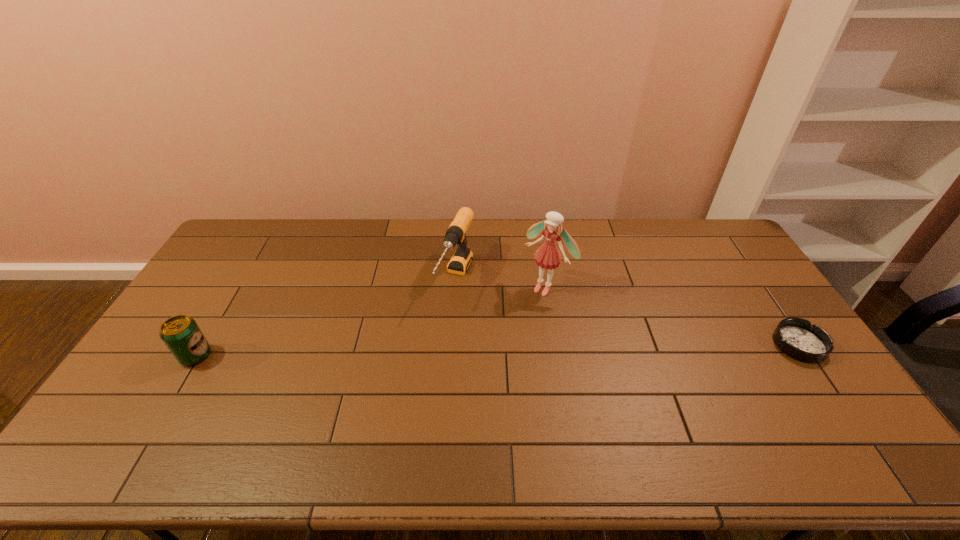
The width and height of the screenshot is (960, 540). In order to click on the leftmost object in this screenshot , I will do `click(181, 334)`.

Where is `the third tallest object`? the third tallest object is located at coordinates pyautogui.click(x=181, y=334).

Where is `the rightmost object`? The image size is (960, 540). the rightmost object is located at coordinates (797, 338).

You are a GUI agent. You are given a task and a screenshot of the screen. Output one action in this format:
    pyautogui.click(x=<x>, y=<y>)
    Task: Click on the ashtray
    The width and height of the screenshot is (960, 540).
    Given the screenshot: What is the action you would take?
    pyautogui.click(x=797, y=338)

The width and height of the screenshot is (960, 540). What are the coordinates of `doll` in the screenshot? It's located at (547, 256).

The image size is (960, 540). Identify the location of the second object from right to left. (547, 256).

Where is `the second tallest object`? the second tallest object is located at coordinates (460, 261).

Where is `drill`? The image size is (960, 540). drill is located at coordinates 460,261.

At what (x,y) coordinates should I click in order to perform the action: click on vacant area located on the back of the third tallest object. Please return your answer as a coordinate pair (x, y). This screenshot has height=540, width=960. Looking at the image, I should click on (236, 288).

This screenshot has width=960, height=540. In order to click on vacant space located 0.170m on the back of the ashtray in this screenshot , I will do `click(760, 288)`.